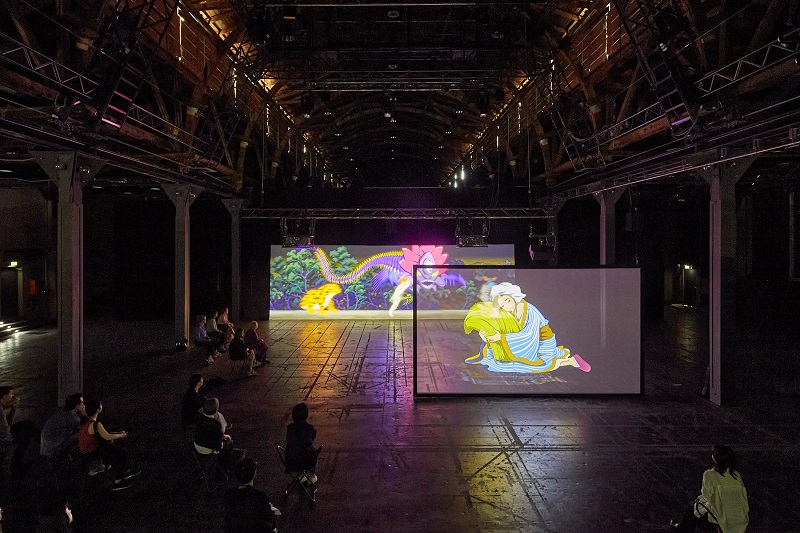
You are a GUI agent. You are given a task and a screenshot of the screen. Output one action in this format:
    pyautogui.click(x=<x>, y=<y>)
    Task: Click on the white light
    Image resolution: width=800 pixels, height=533 pixels.
    Given the screenshot: What is the action you would take?
    pyautogui.click(x=14, y=264), pyautogui.click(x=16, y=332), pyautogui.click(x=9, y=323), pyautogui.click(x=2, y=322), pyautogui.click(x=688, y=266)